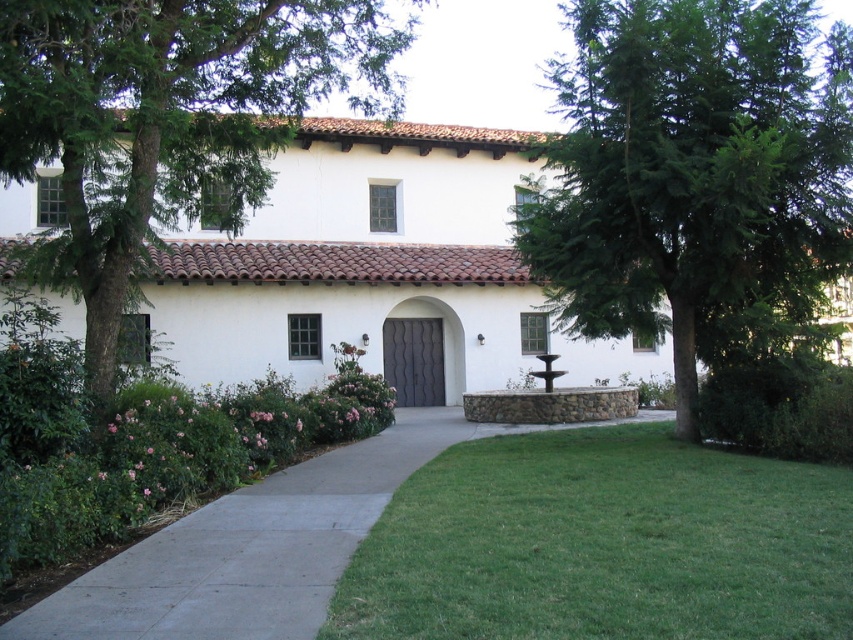
Is green leafy tree at center above green grass at lower center?

Correct, green leafy tree at center is located above green grass at lower center.

Does point (740, 273) lie in front of point (648, 458)?

No.

Identify the location of green leafy tree at center. This screenshot has width=853, height=640. (695, 176).

Between green grass at lower center and concrete at center, which one is positioned higher?

green grass at lower center

Is point (497, 541) positioned behind point (425, 440)?

No, it is not.

Where is `green grass at lower center`? The width and height of the screenshot is (853, 640). green grass at lower center is located at coordinates (602, 545).

Between green leafy tree at center and concrete at center, which one appears on the left side from the viewer's perspective?

Positioned to the left is concrete at center.

Which of these two, green leafy tree at center or concrete at center, stands shorter?

concrete at center is shorter.

Does point (839, 227) come closer to viewer compared to point (190, 529)?

No, it is behind (190, 529).

This screenshot has height=640, width=853. I want to click on green leafy tree at center, so pos(695,176).